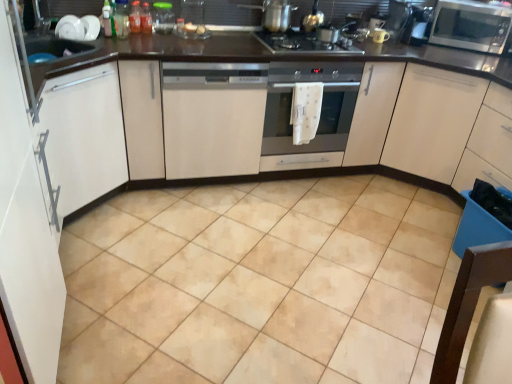
Identify the location of space that is in front of matte ceramic mug at upper center, the first appliance from the right. This screenshot has height=384, width=512. (374, 45).